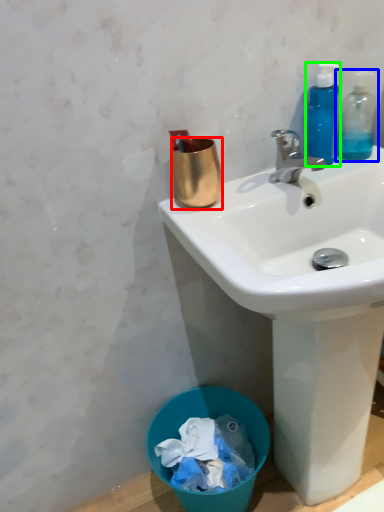
Question: Which object is positioned farthest from coffee cup (highlighted by a red box)? Select from bottle (highlighted by a blue box) and bottle (highlighted by a green box).

Choices:
 (A) bottle
 (B) bottle

Answer: (A)